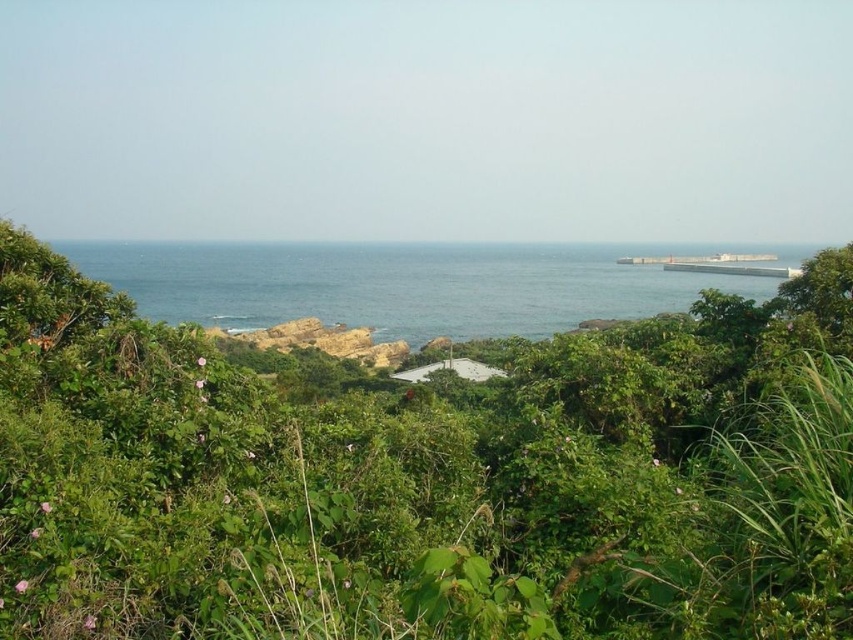
Does green leafy bush at center come behind blue water at center?

No, it is not.

The height and width of the screenshot is (640, 853). Describe the element at coordinates (424, 476) in the screenshot. I see `green leafy bush at center` at that location.

Who is more forward, (769, 317) or (196, 272)?

Point (769, 317) is in front.

Find the location of a particular element. The width and height of the screenshot is (853, 640). green leafy bush at center is located at coordinates (424, 476).